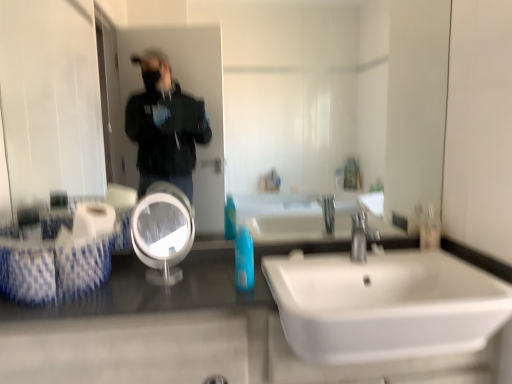
Where is `free location in front of clear plastic bottle at right, which is counted as the first mouthwash, starting from the back`? free location in front of clear plastic bottle at right, which is counted as the first mouthwash, starting from the back is located at coordinates (442, 254).